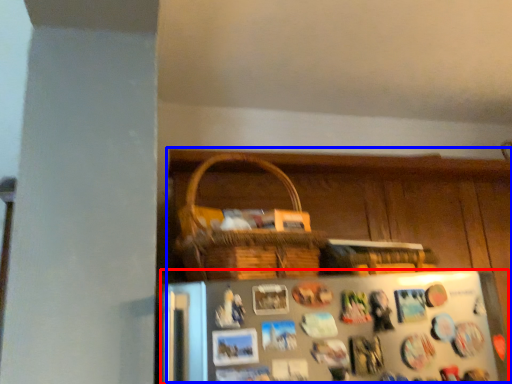
Question: Which of the following is the farthest to the observer, refrigerator (highlighted by a red box) or dresser (highlighted by a blue box)?

Choices:
 (A) refrigerator
 (B) dresser

Answer: (B)